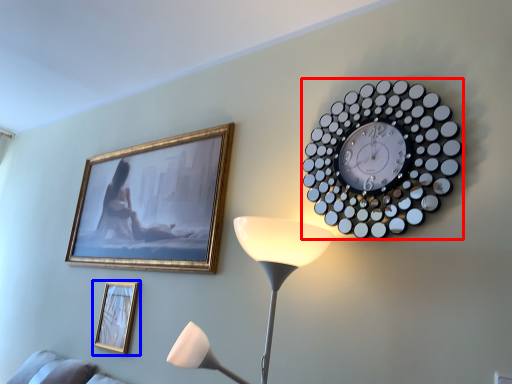
Question: Among these objects, which one is farthest to the camera, wall clock (highlighted by a red box) or picture frame (highlighted by a blue box)?

Choices:
 (A) wall clock
 (B) picture frame

Answer: (B)